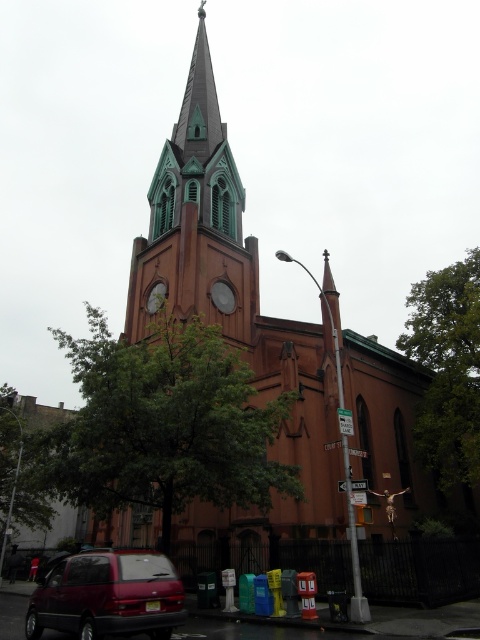
Question: Does green leafy tree at center appear on the left side of matte red minivan at lower left?

Choices:
 (A) yes
 (B) no

Answer: (A)

Question: Which point appears closest to the camera in this image?

Choices:
 (A) (172, 385)
 (B) (141, 600)
 (C) (443, 474)

Answer: (B)

Question: Among these points, which one is nearest to the camera?

Choices:
 (A) (92, 602)
 (B) (450, 362)
 (C) (252, 432)

Answer: (A)

Question: Is green leafy tree at center closer to camera compared to green leafy tree at right?

Choices:
 (A) yes
 (B) no

Answer: (A)

Question: Which of the following is the closest to the observer?

Choices:
 (A) matte red minivan at lower left
 (B) green leafy tree at right
 (C) green leafy tree at center

Answer: (A)

Question: Is green leafy tree at center wider than matte red minivan at lower left?

Choices:
 (A) no
 (B) yes

Answer: (B)